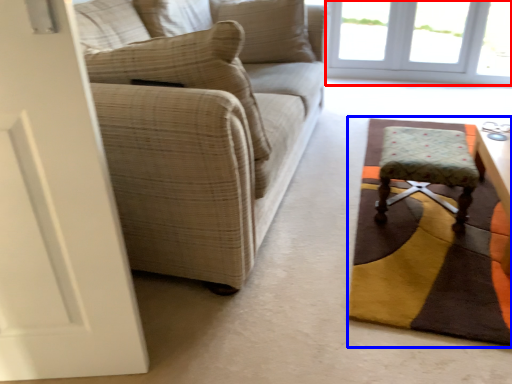
Question: Which of the following is the closest to the observer, window (highlighted by a red box) or mat (highlighted by a blue box)?

Choices:
 (A) window
 (B) mat

Answer: (B)